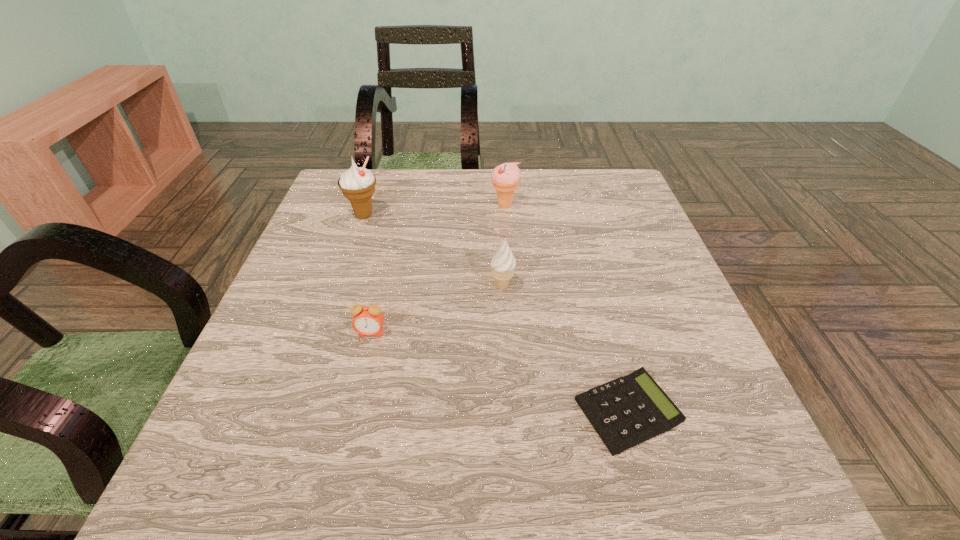
Find the location of a particular element. vacant space located on the front-facing side of the nearest icecream is located at coordinates (451, 287).

In order to click on free space located 0.060m on the face of the second object from left to right in this screenshot , I will do `click(363, 365)`.

Identify the location of vacant space located on the right of the nearest object. (722, 411).

Find the location of `object located in the near edge section of the desktop`. object located in the near edge section of the desktop is located at coordinates (627, 411).

Find the location of a particular element. object at the left edge is located at coordinates (357, 184).

Identify the location of object that is at the right edge. (627, 411).

The image size is (960, 540). What are the coordinates of `object that is at the far left corner` in the screenshot? It's located at (357, 184).

The height and width of the screenshot is (540, 960). Find the location of `object that is at the near right corner`. object that is at the near right corner is located at coordinates (627, 411).

You are a GUI agent. You are given a task and a screenshot of the screen. Output one action in this format:
    pyautogui.click(x=<x>, y=<y>)
    Task: Click on the vacant area at the far edge of the desktop
    
    Given the screenshot: What is the action you would take?
    pyautogui.click(x=448, y=173)

In the image, there is a desktop. Where is `free region at the near edge`? The height and width of the screenshot is (540, 960). free region at the near edge is located at coordinates (501, 485).